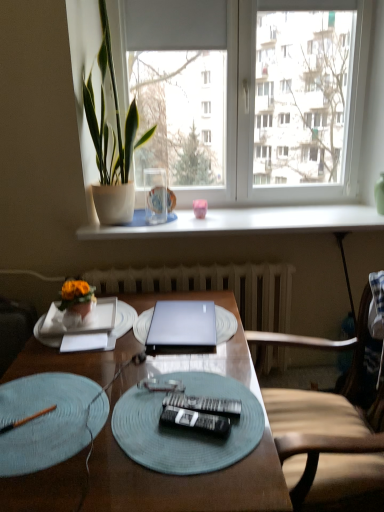
Where is `free space between silver metallic laptop at center and black plastic remote control at center, marked as the second remote control in a back-to-front arrangement`? free space between silver metallic laptop at center and black plastic remote control at center, marked as the second remote control in a back-to-front arrangement is located at coordinates (190, 374).